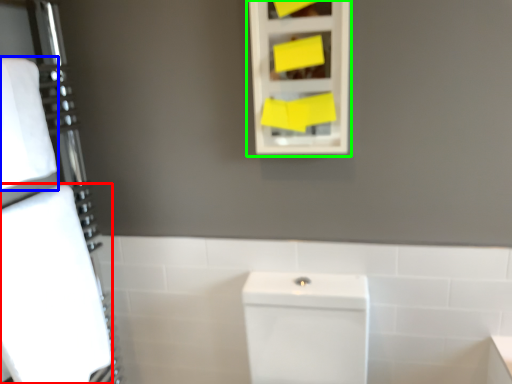
Question: Which object is positioned closest to bath towel (highlighted by a red box)? Select from bath towel (highlighted by a blue box) and medicine cabinet (highlighted by a green box).

Choices:
 (A) bath towel
 (B) medicine cabinet

Answer: (A)